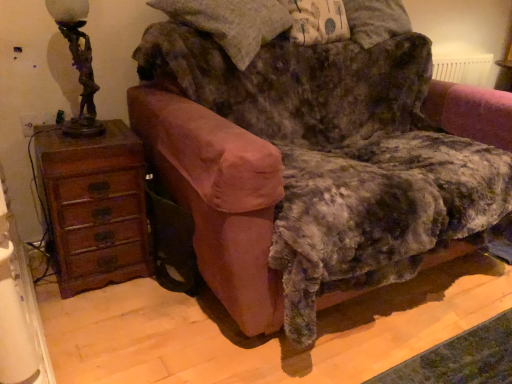
Question: Is the depth of velvet pink armchair at center greater than that of brown wooden chest of drawers at left?

Choices:
 (A) yes
 (B) no

Answer: (B)

Question: Is velvet pink armchair at center not within brown wooden chest of drawers at left?

Choices:
 (A) no
 (B) yes

Answer: (B)

Question: From a real-world perspective, is velvet pink armchair at center located beneath brown wooden chest of drawers at left?

Choices:
 (A) yes
 (B) no

Answer: (B)

Question: Is velvet pink armchair at center looking in the opposite direction of brown wooden chest of drawers at left?

Choices:
 (A) no
 (B) yes

Answer: (A)

Question: Is velvet pink armchair at center touching brown wooden chest of drawers at left?

Choices:
 (A) no
 (B) yes

Answer: (A)

Question: Is point (88, 44) closer or farther from the camera than point (205, 96)?

Choices:
 (A) farther
 (B) closer

Answer: (B)

Question: From the image's perspective, is bronze statue-like at left above or below velvet pink armchair at center?

Choices:
 (A) below
 (B) above

Answer: (B)

Question: Looking at the image, does bronze statue-like at left seem bigger or smaller compared to velvet pink armchair at center?

Choices:
 (A) small
 (B) big

Answer: (A)

Question: Is bronze statue-like at left in front of or behind velvet pink armchair at center in the image?

Choices:
 (A) front
 (B) behind

Answer: (B)

Question: Is brown wooden chest of drawers at left inside or outside of velvet pink armchair at center?

Choices:
 (A) outside
 (B) inside

Answer: (A)

Question: From the image's perspective, is brown wooden chest of drawers at left located above or below velvet pink armchair at center?

Choices:
 (A) above
 (B) below

Answer: (B)

Question: From their relative heights in the image, would you say brown wooden chest of drawers at left is taller or shorter than velvet pink armchair at center?

Choices:
 (A) tall
 (B) short

Answer: (B)

Question: Considering the relative positions of brown wooden chest of drawers at left and velvet pink armchair at center in the image provided, is brown wooden chest of drawers at left to the left or to the right of velvet pink armchair at center?

Choices:
 (A) left
 (B) right

Answer: (A)

Question: Considering their positions, is velvet pink armchair at center located in front of or behind bronze statue-like at left?

Choices:
 (A) behind
 (B) front

Answer: (B)

Question: Is point (232, 180) positioned closer to the camera than point (66, 23)?

Choices:
 (A) farther
 (B) closer

Answer: (B)